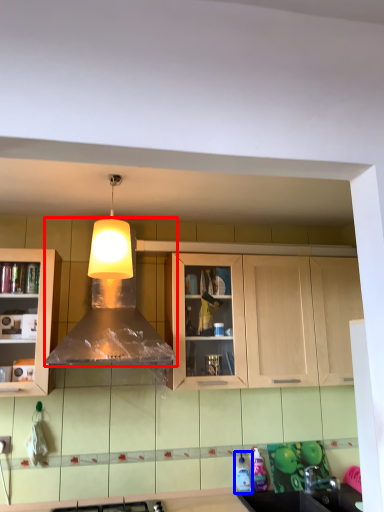
Question: Which of the following is the closest to the observer, hood (highlighted by a red box) or bottle (highlighted by a blue box)?

Choices:
 (A) hood
 (B) bottle

Answer: (A)